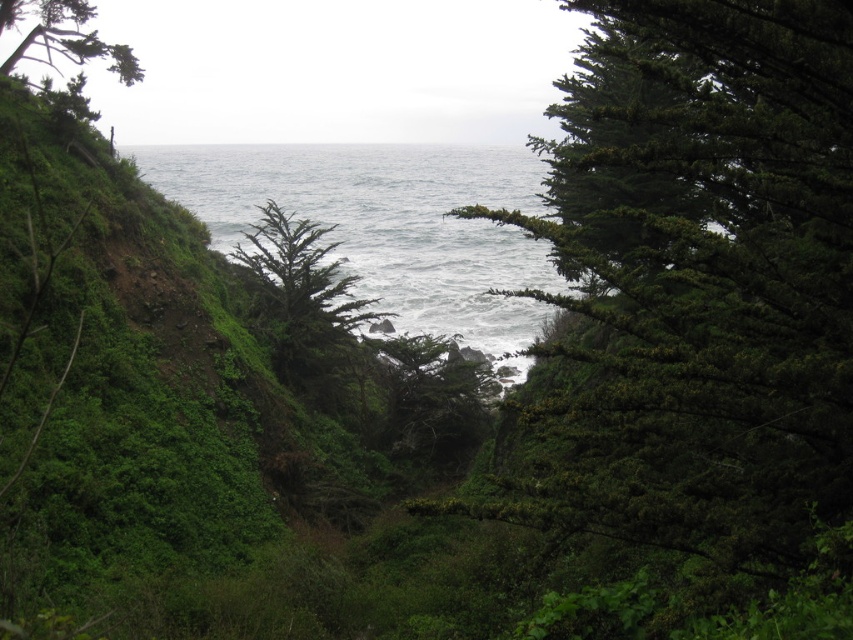
Question: Considering the real-world distances, which object is farthest from the green needle-like foliage at center?

Choices:
 (A) gray water at center
 (B) green textured tree at upper left

Answer: (A)

Question: Observing the image, what is the correct spatial positioning of gray water at center in reference to green textured tree at upper left?

Choices:
 (A) right
 (B) left

Answer: (A)

Question: Among these objects, which one is farthest from the camera?

Choices:
 (A) gray water at center
 (B) green textured tree at upper left
 (C) green needle-like foliage at center

Answer: (B)

Question: Considering the real-world distances, which object is closest to the green textured tree at upper left?

Choices:
 (A) green needle-like foliage at center
 (B) gray water at center

Answer: (A)

Question: Is green needle-like foliage at center positioned at the back of gray water at center?

Choices:
 (A) yes
 (B) no

Answer: (B)

Question: Can you confirm if gray water at center is positioned below green textured tree at upper left?

Choices:
 (A) yes
 (B) no

Answer: (B)